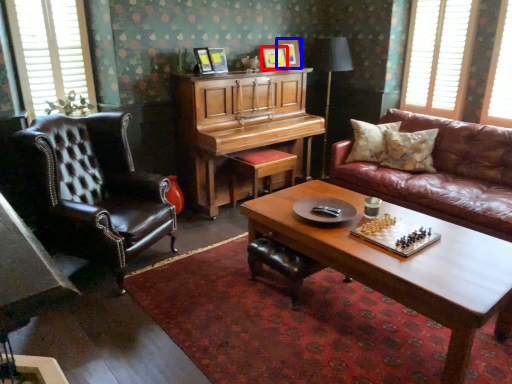
Question: Among these objects, which one is farthest to the camera, picture frame (highlighted by a red box) or picture frame (highlighted by a blue box)?

Choices:
 (A) picture frame
 (B) picture frame

Answer: (B)